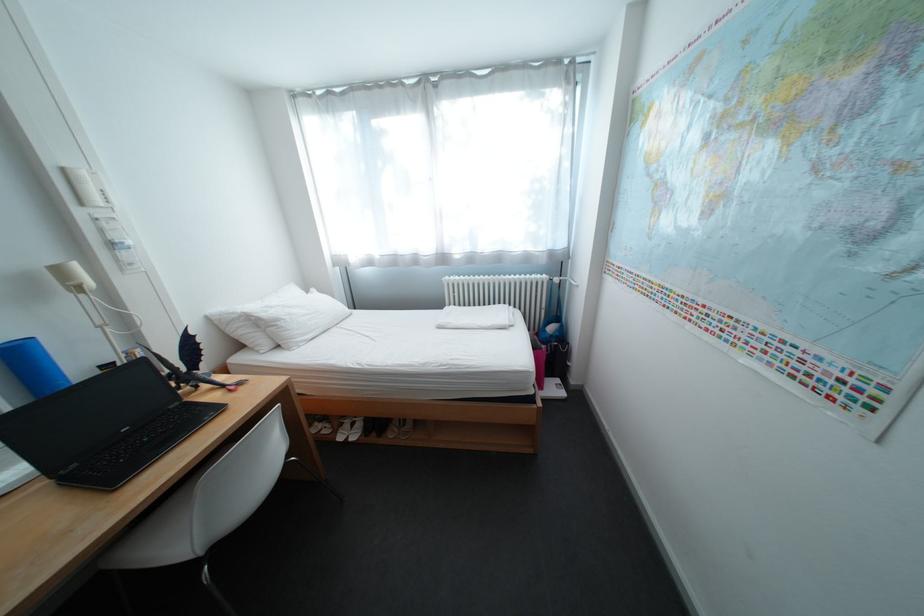
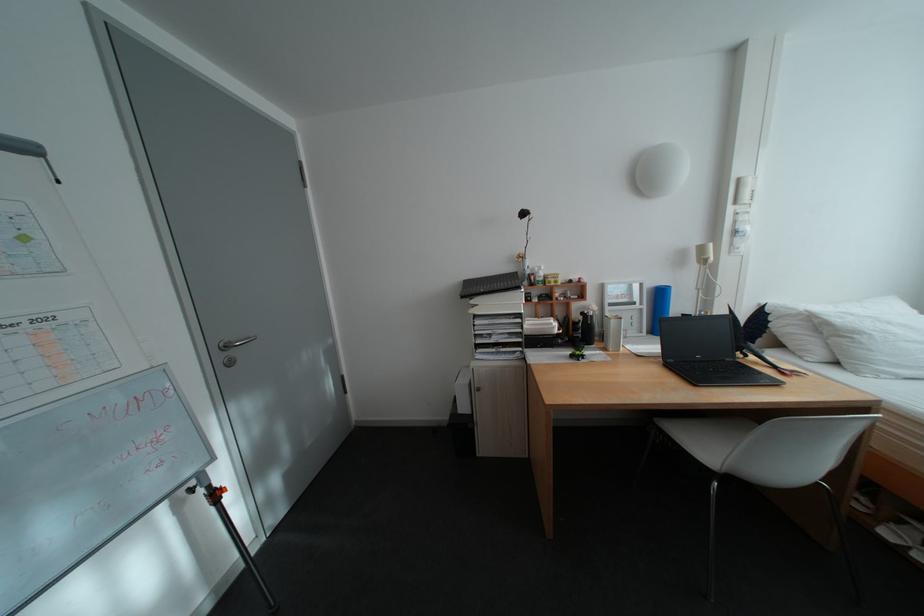
The point at (292, 322) is marked in the first image. Where is the corresponding point in the second image?

(871, 334)